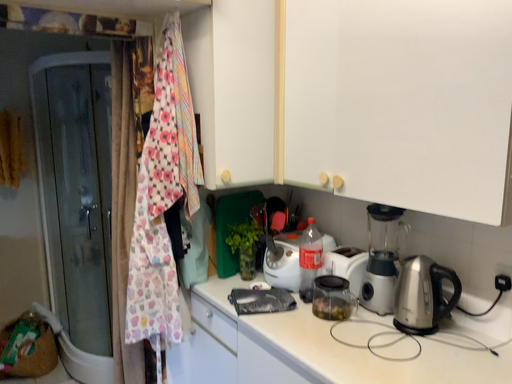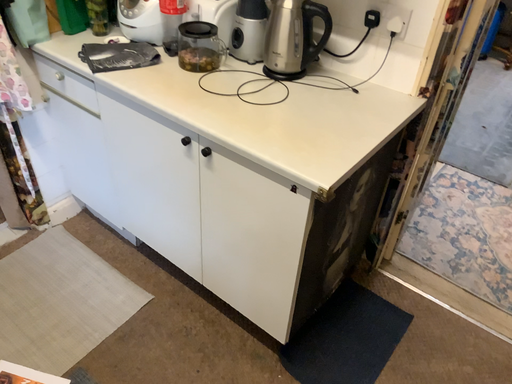
Question: How did the camera likely rotate when shooting the video?

Choices:
 (A) rotated upward
 (B) rotated downward

Answer: (B)